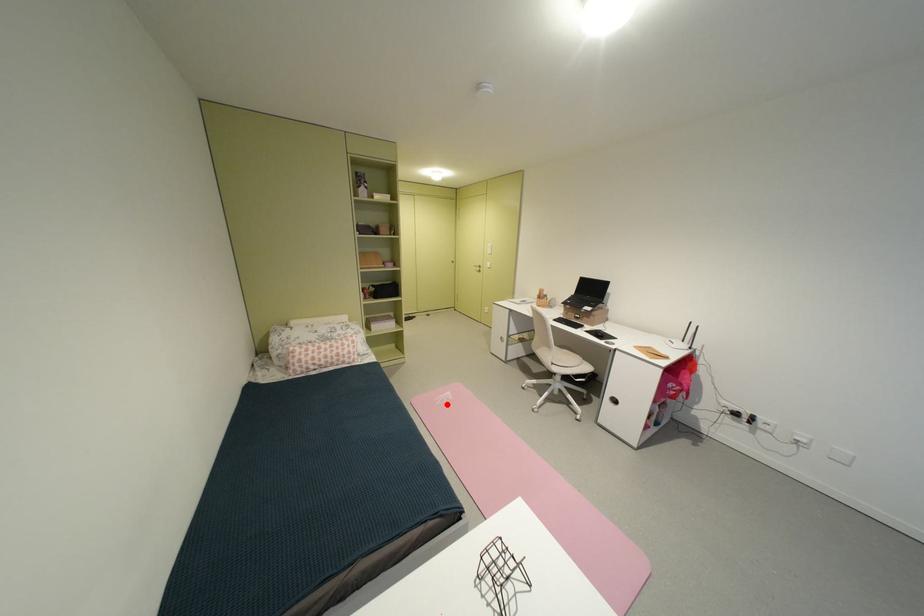
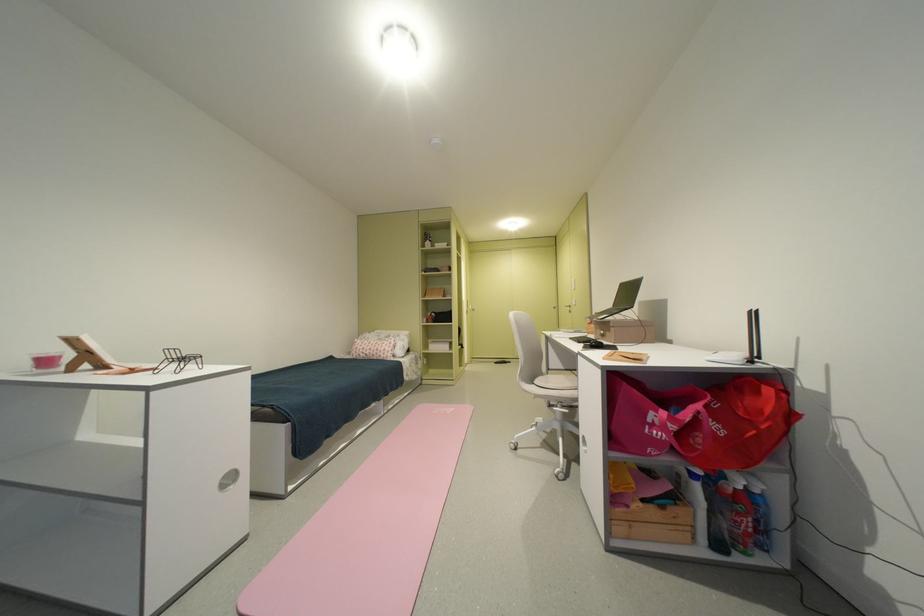
Locate, in the second image, the point that corresponds to the highlighted location in the first image.

(444, 413)